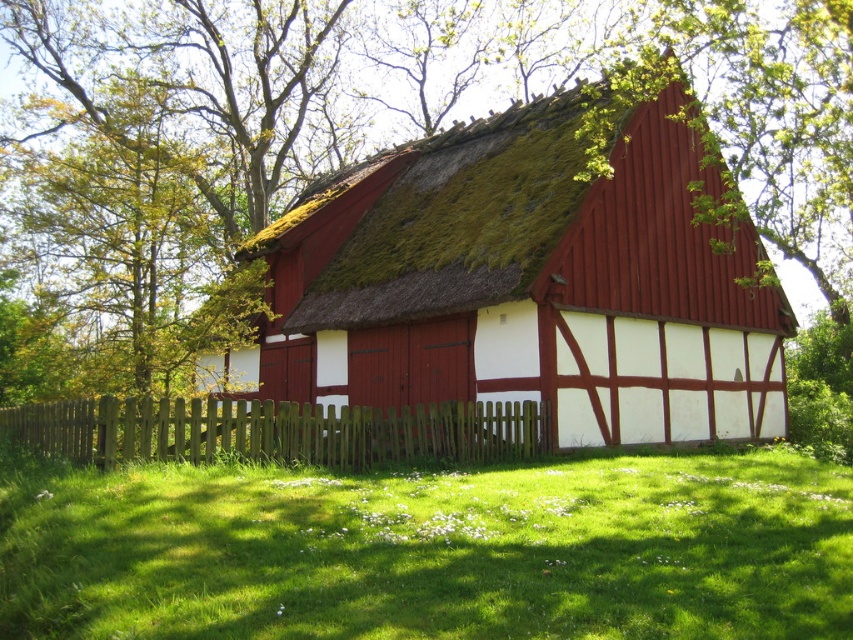
Based on the photo, you are standing in front of the traditional red and white half timbered building. You see green grass at lower center and brown wooden fence at lower center. Which object is positioned to the right side?

The green grass at lower center is positioned to the right of the brown wooden fence at lower center.